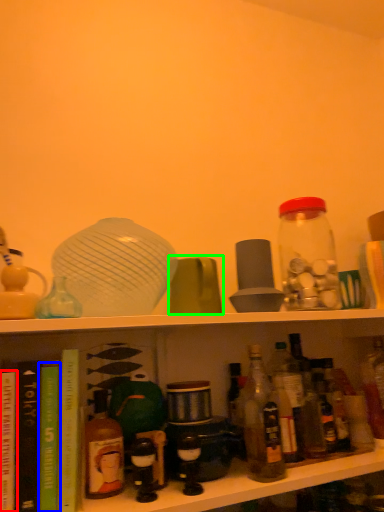
Question: Which is farther away from book (highlighted by a red box)? book (highlighted by a blue box) or tableware (highlighted by a green box)?

Choices:
 (A) book
 (B) tableware

Answer: (B)